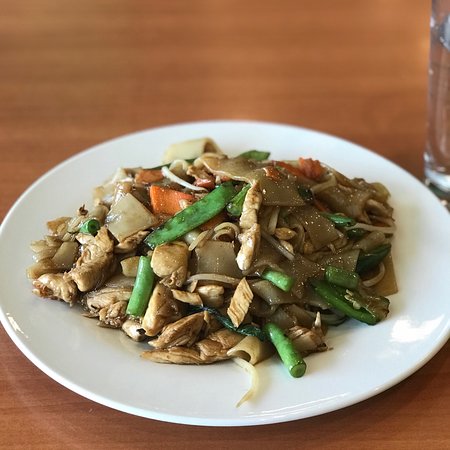
This screenshot has width=450, height=450. I want to click on empty table space, so click(244, 75).